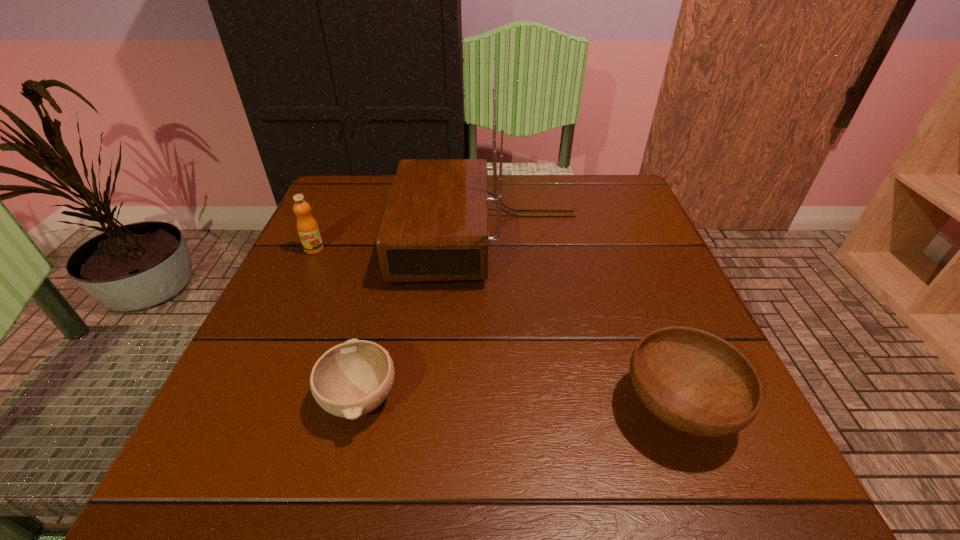
Locate an element on the screen. free spot that satisfies the following two spatial constraints: 1. on the front panel of the tallest object; 2. on the front label of the second tallest object is located at coordinates (490, 249).

This screenshot has height=540, width=960. In order to click on vacant area that satisfies the following two spatial constraints: 1. on the front panel of the tallest object; 2. on the front label of the leftmost object in this screenshot , I will do `click(490, 249)`.

This screenshot has width=960, height=540. Identify the location of vacant area that satisfies the following two spatial constraints: 1. on the front panel of the radio_receiver; 2. on the front label of the orange juice. (490, 249).

The width and height of the screenshot is (960, 540). What are the coordinates of `free region that satisfies the following two spatial constraints: 1. on the front label of the shorter bowl; 2. on the right side of the third shortest object` in the screenshot? It's located at tap(245, 398).

At what (x,y) coordinates should I click in order to perform the action: click on free space that satisfies the following two spatial constraints: 1. on the front label of the second tallest object; 2. on the right side of the shorter bowl. Please return your answer as a coordinate pair (x, y). Image resolution: width=960 pixels, height=540 pixels. Looking at the image, I should click on (245, 398).